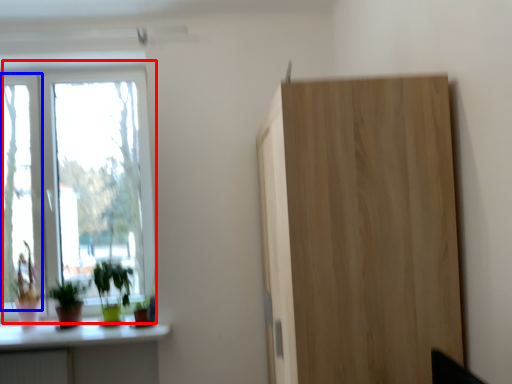
Question: Which point is further to the camera, window (highlighted by a red box) or window (highlighted by a blue box)?

Choices:
 (A) window
 (B) window

Answer: (A)